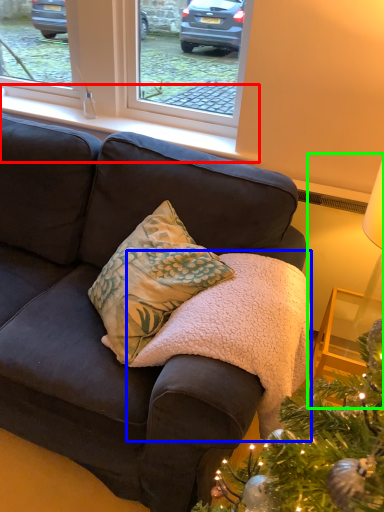
Question: Considering the real-world distances, which object is farthest from window sill (highlighted by a red box)? blanket (highlighted by a blue box) or table lamp (highlighted by a green box)?

Choices:
 (A) blanket
 (B) table lamp

Answer: (B)